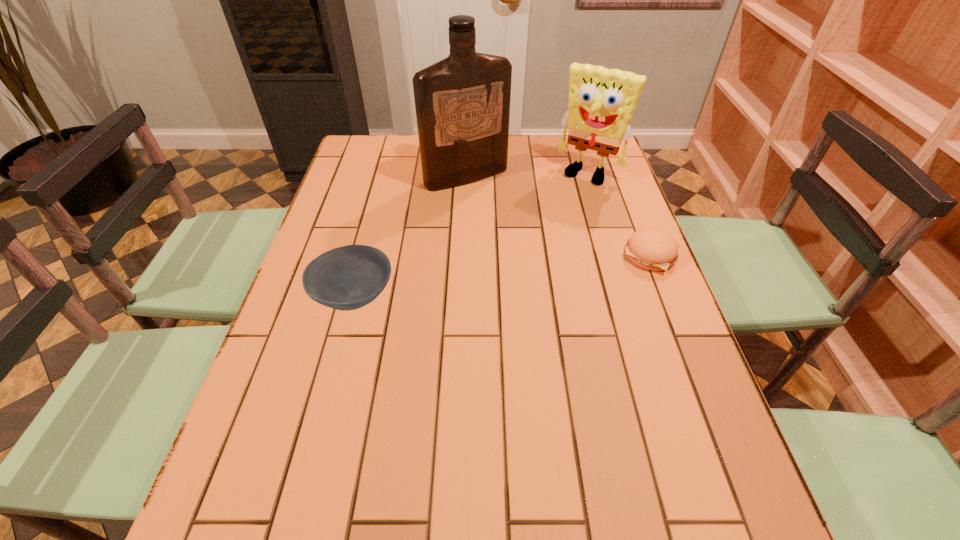
In order to click on free space located on the label side of the tallest object in this screenshot , I will do `click(514, 224)`.

At what (x,y) coordinates should I click in order to perform the action: click on vacant region located on the face of the third shortest object. Please return your answer as a coordinate pair (x, y). The width and height of the screenshot is (960, 540). Looking at the image, I should click on (550, 225).

Locate an element on the screen. This screenshot has height=540, width=960. vacant space situated 0.130m on the face of the third shortest object is located at coordinates (562, 207).

The image size is (960, 540). Find the location of `free space located 0.110m on the face of the third shortest object`. free space located 0.110m on the face of the third shortest object is located at coordinates (564, 204).

Identify the location of liquor that is at the far edge. (462, 102).

The image size is (960, 540). Identify the location of sponge that is at the far edge. (601, 103).

Identify the location of object present at the left edge. (346, 278).

At what (x,y) coordinates should I click in order to perform the action: click on patty that is at the right edge. Please return your answer as a coordinate pair (x, y). This screenshot has height=540, width=960. Looking at the image, I should click on (652, 249).

Locate an element on the screen. This screenshot has width=960, height=540. sponge at the right edge is located at coordinates (601, 103).

Identify the location of object that is positioned at the far right corner. This screenshot has width=960, height=540. (601, 103).